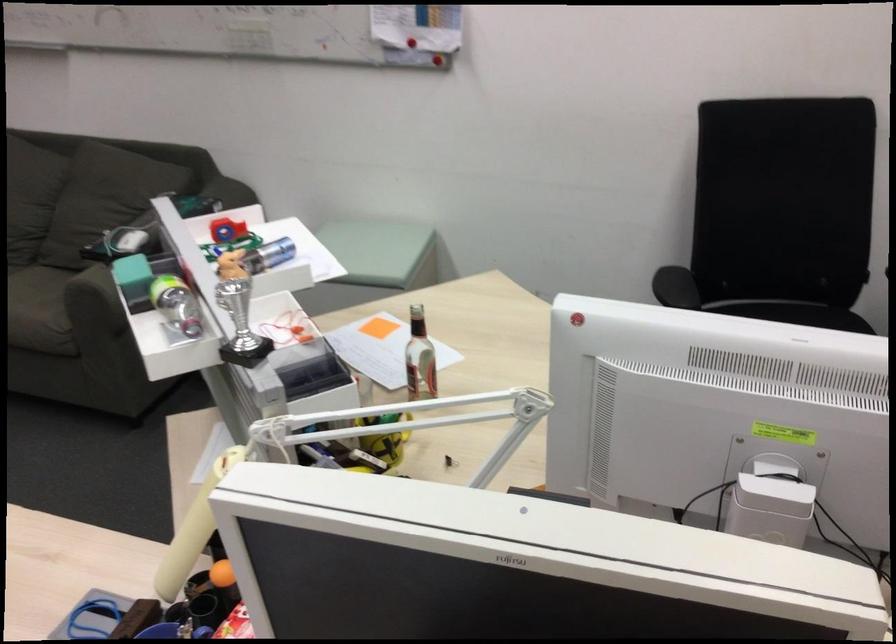
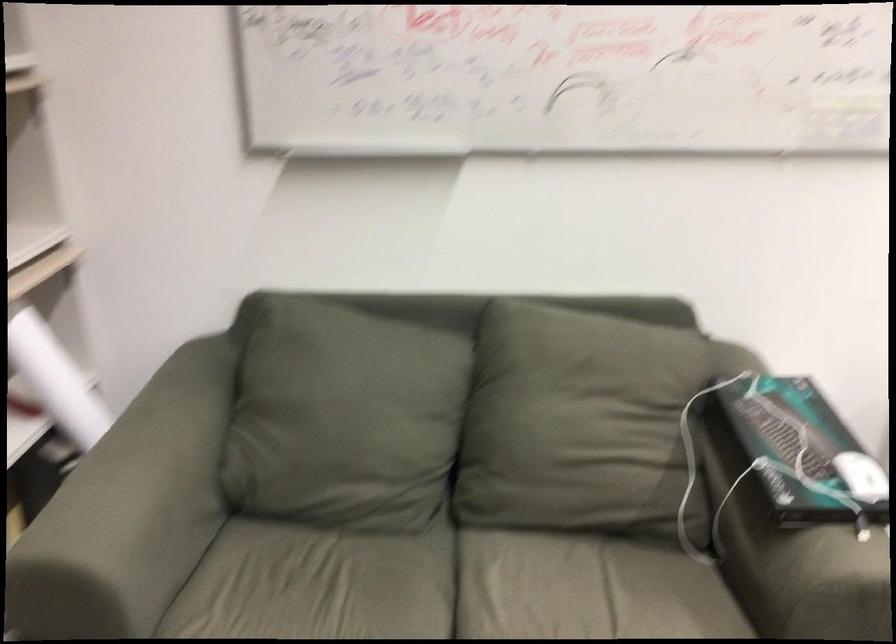
Which direction would the cameraman need to move to produce the second image?

The cameraman walked toward left, forward.